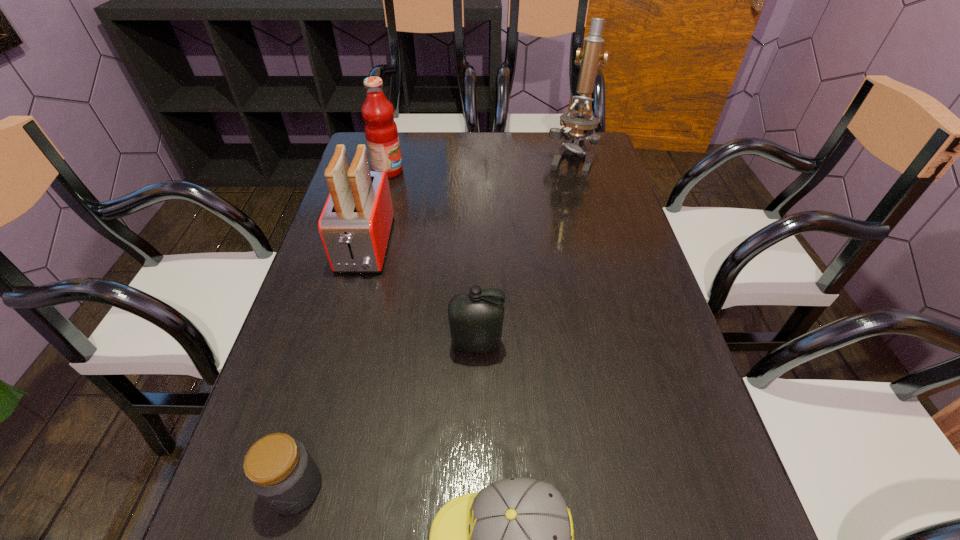
Locate an element on the screen. The height and width of the screenshot is (540, 960). vacant point located 0.210m on the left of the third nearest object is located at coordinates (349, 345).

Locate an element on the screen. microscope that is at the far edge is located at coordinates (582, 123).

At what (x,y) coordinates should I click in order to perform the action: click on fruit juice that is at the far edge. Please return your answer as a coordinate pair (x, y). Looking at the image, I should click on (381, 132).

I want to click on fruit juice that is at the left edge, so pyautogui.click(x=381, y=132).

The image size is (960, 540). What are the coordinates of `toaster that is at the left edge` in the screenshot? It's located at (355, 225).

The height and width of the screenshot is (540, 960). In order to click on jar located at the left edge in this screenshot , I will do `click(279, 469)`.

Find the location of a particular element. The width and height of the screenshot is (960, 540). object positioned at the right edge is located at coordinates (582, 123).

I want to click on object that is at the far left corner, so click(381, 132).

Image resolution: width=960 pixels, height=540 pixels. In order to click on object positioned at the far right corner in this screenshot , I will do `click(582, 123)`.

At what (x,y) coordinates should I click in order to perform the action: click on free space at the far edge. Please return your answer as a coordinate pair (x, y). Image resolution: width=960 pixels, height=540 pixels. Looking at the image, I should click on (545, 158).